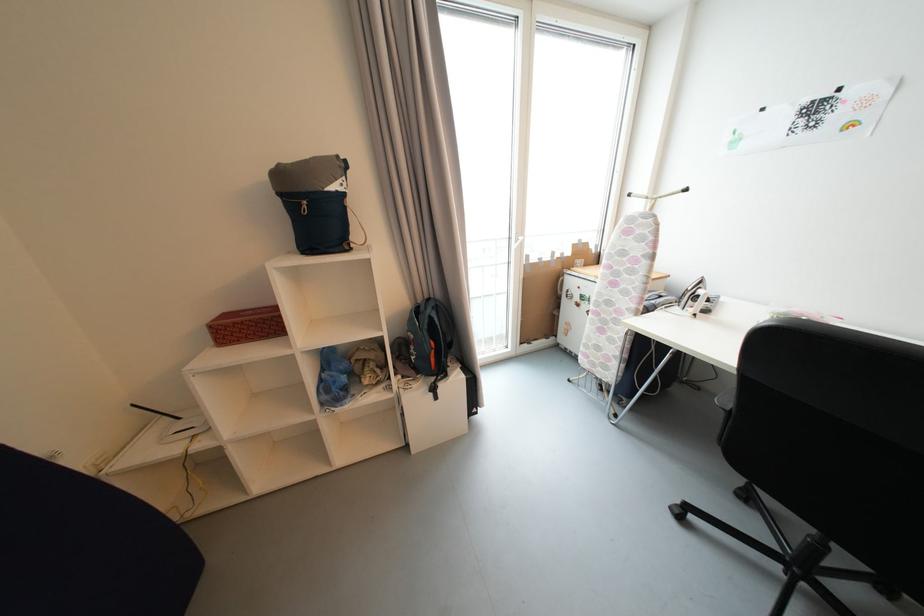
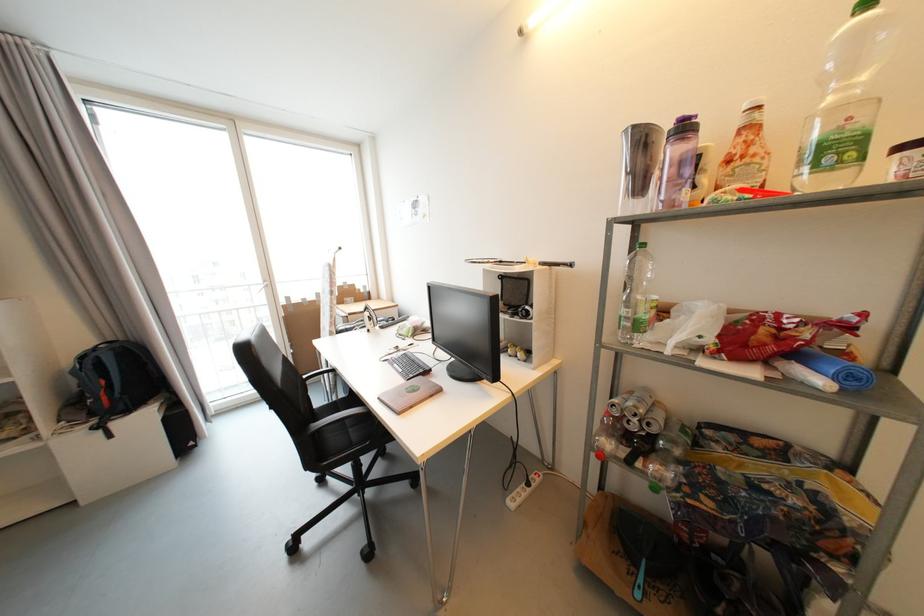
The images are taken continuously from a first-person perspective. In which direction are you moving?

The movement direction of the cameraman is right, backward.